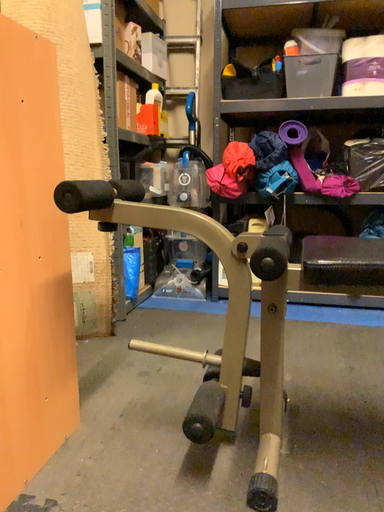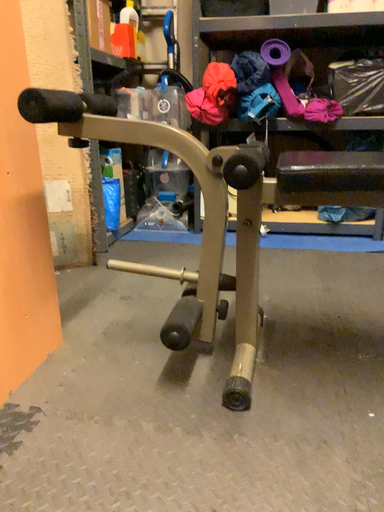
Question: How did the camera likely rotate when shooting the video?

Choices:
 (A) rotated downward
 (B) rotated upward

Answer: (A)